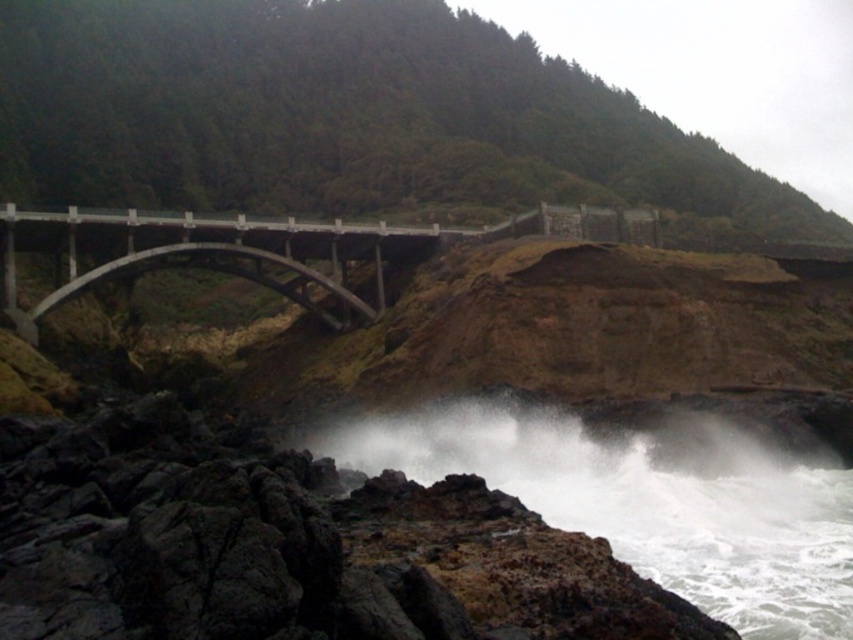
You are a photographer planning to capture the white frothy water at lower center and the concrete bridge at center in a single shot. Based on their positions, which object should you focus on first to ensure both are in frame?

The white frothy water at lower center is below the concrete bridge at center, so you should focus on the concrete bridge at center first to ensure both are in frame.

You are a hiker standing at the base of the bridge and want to reach the point marked as point (708,508). There is a strong wind blowing from the direction of point (428,240). Which direction should you face to avoid the wind while reaching your destination?

Since point (708,508) is in front of point (428,240), you should face away from point (428,240) to avoid the wind blowing from that direction while moving towards point (708,508).

You are a photographer standing on the rocky shore and want to capture both the white frothy water at lower center and the concrete bridge at center in your shot. Which object will appear larger in the photo?

The concrete bridge at center will appear larger in the photo because it is taller than the white frothy water at lower center.